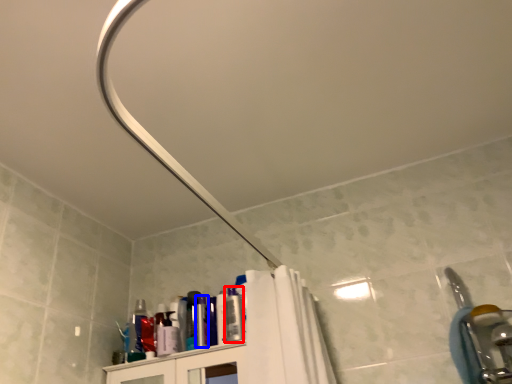
Question: Which point is further to the camera, toiletry (highlighted by a red box) or toiletry (highlighted by a blue box)?

Choices:
 (A) toiletry
 (B) toiletry

Answer: (B)